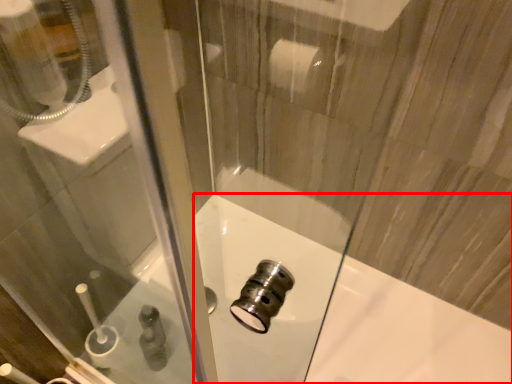
Question: From the image's perspective, considering the relative positions of bath (annotated by the red box) and toiletry in the image provided, where is bath (annotated by the red box) located with respect to the staircase?

Choices:
 (A) below
 (B) above

Answer: (A)